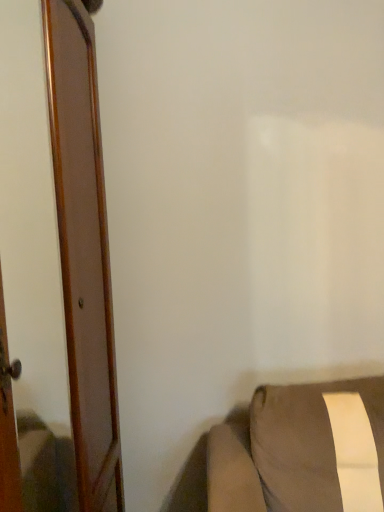
This screenshot has width=384, height=512. In order to click on wooden door at left in this screenshot , I will do `click(83, 252)`.

This screenshot has height=512, width=384. Describe the element at coordinates (83, 252) in the screenshot. I see `wooden door at left` at that location.

This screenshot has height=512, width=384. I want to click on brown fabric cushion at lower right, so 303,451.

The width and height of the screenshot is (384, 512). Describe the element at coordinates (303, 451) in the screenshot. I see `brown fabric cushion at lower right` at that location.

Measure the distance between brown fabric cushion at lower right and camera.

1.28 meters.

Locate an element on the screen. Image resolution: width=384 pixels, height=512 pixels. wooden door at left is located at coordinates (83, 252).

Which is more to the left, wooden door at left or brown fabric cushion at lower right?

From the viewer's perspective, wooden door at left appears more on the left side.

Consider the image. Does wooden door at left come behind brown fabric cushion at lower right?

No, it is not.

Is point (69, 47) positioned in front of point (361, 391)?

Yes, point (69, 47) is closer to viewer.

From the image's perspective, is wooden door at left under brown fabric cushion at lower right?

Incorrect, from the image's perspective, wooden door at left is higher than brown fabric cushion at lower right.

From a real-world perspective, which is physically below, wooden door at left or brown fabric cushion at lower right?

brown fabric cushion at lower right.

Based on the photo, which object is thinner, wooden door at left or brown fabric cushion at lower right?

Thinner between the two is wooden door at left.

Does wooden door at left have a lesser height compared to brown fabric cushion at lower right?

In fact, wooden door at left may be taller than brown fabric cushion at lower right.

Which of these two, wooden door at left or brown fabric cushion at lower right, is bigger?

With larger size is wooden door at left.

From the picture: Is wooden door at left not inside brown fabric cushion at lower right?

Yes, wooden door at left is outside of brown fabric cushion at lower right.

From the picture: Are wooden door at left and brown fabric cushion at lower right beside each other?

No, wooden door at left is not with brown fabric cushion at lower right.

Does wooden door at left turn towards brown fabric cushion at lower right?

Yes, wooden door at left is facing brown fabric cushion at lower right.

How different are the orientations of wooden door at left and brown fabric cushion at lower right in degrees?

The facing directions of wooden door at left and brown fabric cushion at lower right are 89.7 degrees apart.

At what (x,y) coordinates should I click in order to perform the action: click on furniture below the wooden door at left (from a real-world perspective). Please return your answer as a coordinate pair (x, y). Looking at the image, I should click on (303, 451).

Does brown fabric cushion at lower right appear on the left side of wooden door at left?

No, brown fabric cushion at lower right is not to the left of wooden door at left.

In the image, is brown fabric cushion at lower right positioned in front of or behind wooden door at left?

Clearly, brown fabric cushion at lower right is behind wooden door at left.

Considering the points (343, 460) and (92, 25), which point is in front, point (343, 460) or point (92, 25)?

The point (343, 460) is in front.

From the image's perspective, does brown fabric cushion at lower right appear lower than wooden door at left?

Indeed, from the image's perspective, brown fabric cushion at lower right is shown beneath wooden door at left.

From a real-world perspective, does brown fabric cushion at lower right sit lower than wooden door at left?

Correct, in the physical world, brown fabric cushion at lower right is lower than wooden door at left.

Consider the image. Considering the sizes of objects brown fabric cushion at lower right and wooden door at left in the image provided, who is thinner, brown fabric cushion at lower right or wooden door at left?

wooden door at left.

From the picture: Between brown fabric cushion at lower right and wooden door at left, which one has less height?

brown fabric cushion at lower right.

Is brown fabric cushion at lower right smaller than wooden door at left?

Indeed, brown fabric cushion at lower right has a smaller size compared to wooden door at left.

Is brown fabric cushion at lower right surrounding wooden door at left?

No, wooden door at left is located outside of brown fabric cushion at lower right.

Is brown fabric cushion at lower right in contact with wooden door at left?

No, brown fabric cushion at lower right is not beside wooden door at left.

Is brown fabric cushion at lower right oriented away from wooden door at left?

No, wooden door at left is not at the back of brown fabric cushion at lower right.

Find the location of a particular element. The image size is (384, 512). furniture behind the wooden door at left is located at coordinates (303, 451).

This screenshot has height=512, width=384. Identify the location of furniture on the right of the wooden door at left. (303, 451).

In order to click on furniture that appears below the wooden door at left (from the image's perspective) in this screenshot , I will do [x=303, y=451].